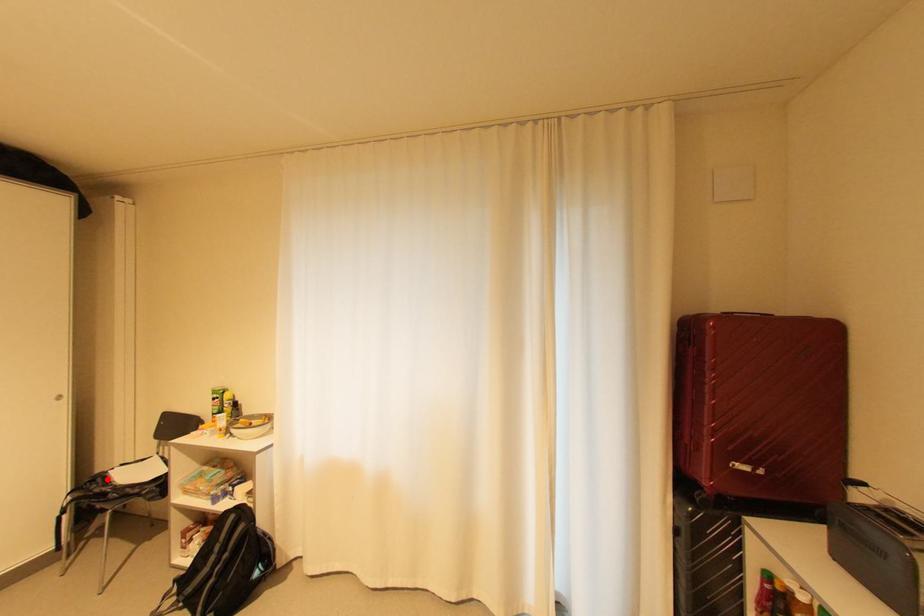
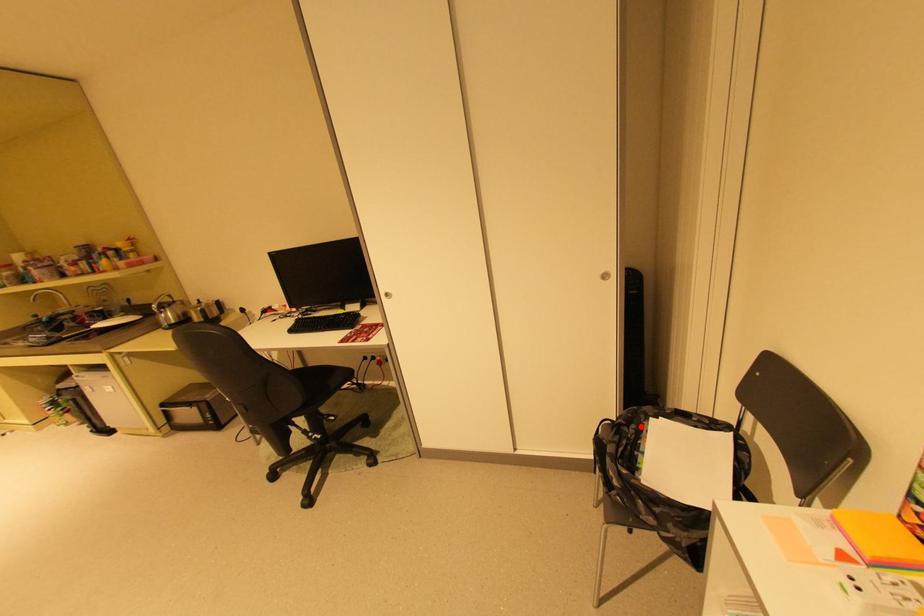
I am providing you with two images of the same scene from different viewpoints. A red point is marked on the first image and another point is marked on the second image. Is the marked point in image1 the same physical position as the marked point in image2?

Yes